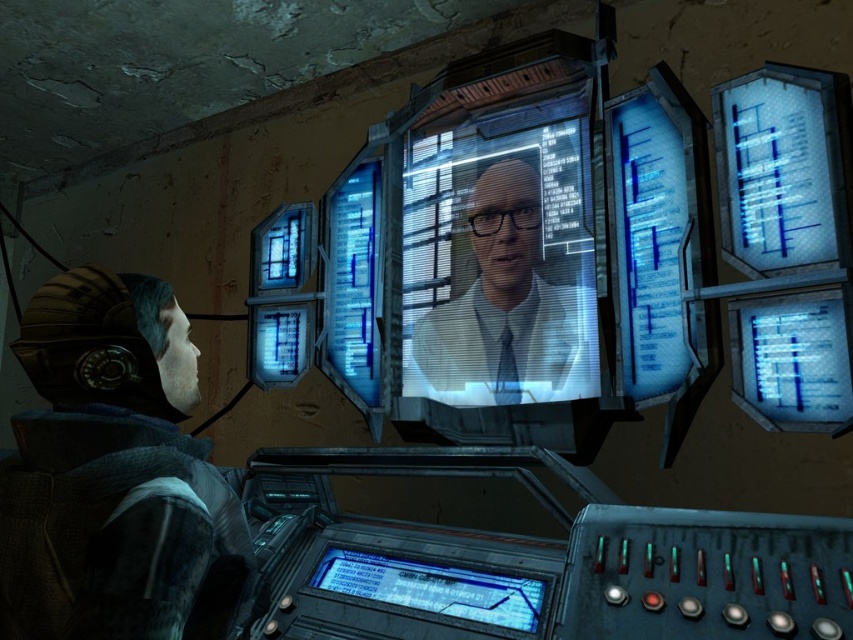
Question: Based on their relative distances, which object is farther from the camouflage jacket at left?

Choices:
 (A) matte white shirt at center
 (B) blue transparent display at bottom center

Answer: (A)

Question: Is camouflage jacket at left wider than blue transparent display at bottom center?

Choices:
 (A) no
 (B) yes

Answer: (A)

Question: Estimate the real-world distances between objects in this image. Which object is closer to the blue transparent display at bottom center?

Choices:
 (A) camouflage jacket at left
 (B) matte white shirt at center

Answer: (B)

Question: Which of the following is the farthest from the observer?

Choices:
 (A) matte white shirt at center
 (B) blue transparent display at bottom center

Answer: (A)

Question: Can you confirm if camouflage jacket at left is bigger than blue transparent display at bottom center?

Choices:
 (A) no
 (B) yes

Answer: (B)

Question: Can you confirm if camouflage jacket at left is bigger than matte white shirt at center?

Choices:
 (A) yes
 (B) no

Answer: (B)